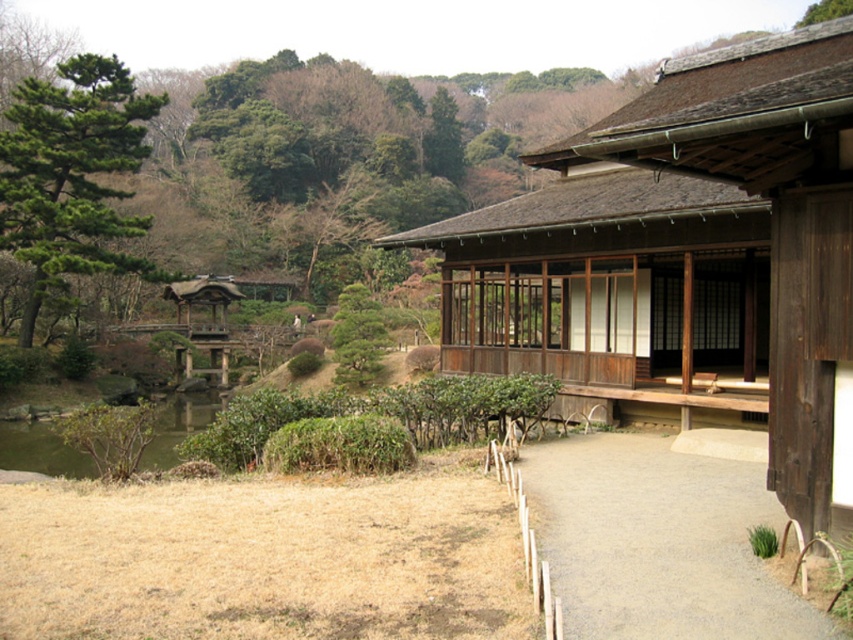
Looking at this image, does green grassy pond at lower left come behind green textured pine tree at center?

No, it is not.

Which is above, green grassy pond at lower left or green textured pine tree at center?

green textured pine tree at center

What do you see at coordinates (39, 451) in the screenshot? The image size is (853, 640). I see `green grassy pond at lower left` at bounding box center [39, 451].

Image resolution: width=853 pixels, height=640 pixels. I want to click on green grassy pond at lower left, so click(x=39, y=451).

Can you confirm if gray gravel path at center is smaller than green grassy pond at lower left?

Yes.

The image size is (853, 640). What do you see at coordinates (659, 541) in the screenshot?
I see `gray gravel path at center` at bounding box center [659, 541].

Is point (537, 509) farther from viewer compared to point (173, 436)?

No, (537, 509) is closer to viewer.

In order to click on gray gravel path at center in this screenshot , I will do `click(659, 541)`.

Can you confirm if gray gravel path at center is wider than green needle-like tree at left?

In fact, gray gravel path at center might be narrower than green needle-like tree at left.

Between gray gravel path at center and green needle-like tree at left, which one appears on the right side from the viewer's perspective?

gray gravel path at center is more to the right.

Does point (602, 564) come farther from viewer compared to point (15, 90)?

No, (602, 564) is in front of (15, 90).

Identify the location of gray gravel path at center. This screenshot has height=640, width=853. (659, 541).